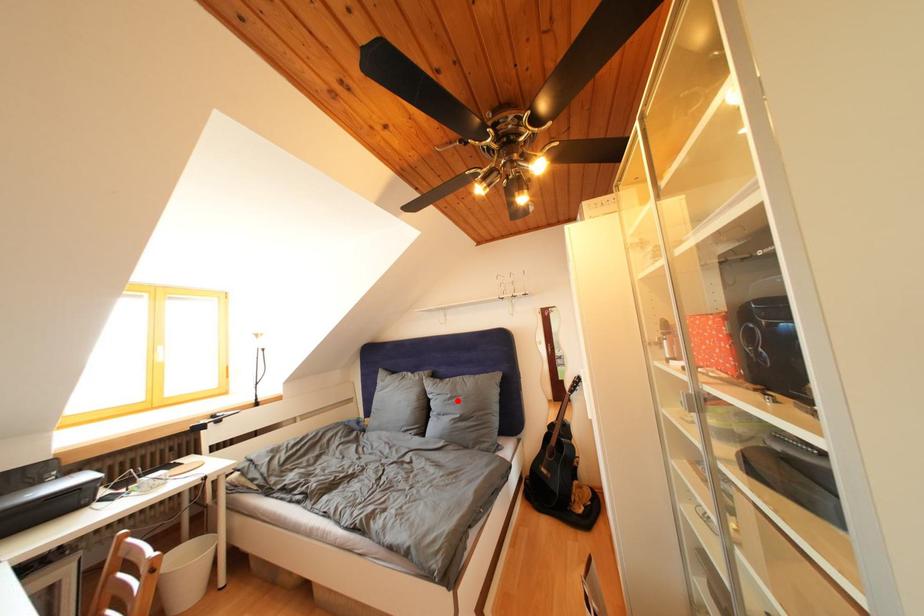
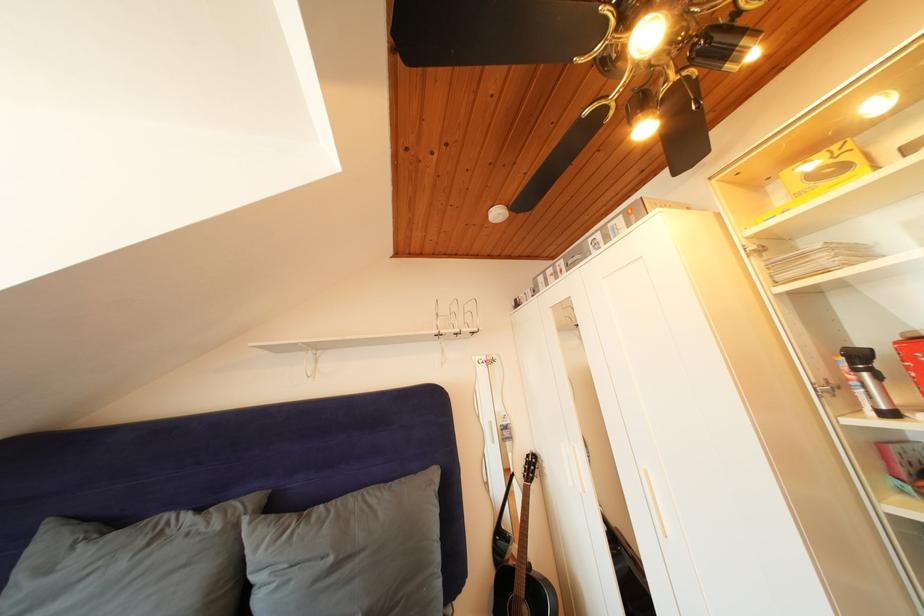
Question: I am providing you with two images of the same scene from different viewpoints. A red point is shown in image1. For the corresponding object point in image2, is it positioned nearer or farther from the camera?

Choices:
 (A) Nearer
 (B) Farther

Answer: (A)